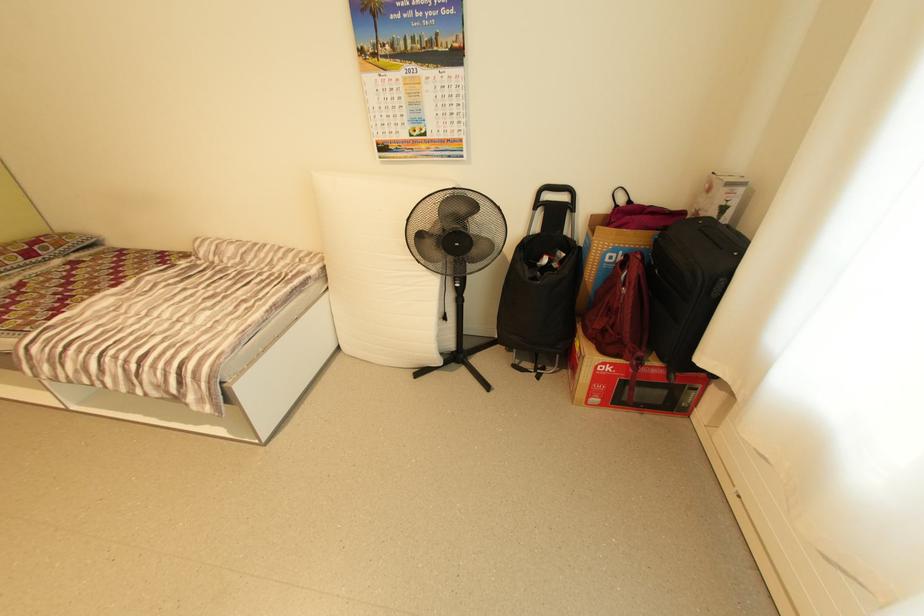
Which object does [629,383] point to?

It refers to a microwave cardboard box.